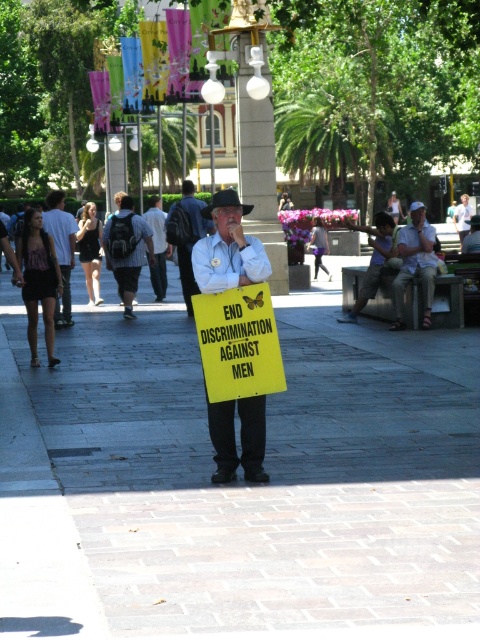
You are a photographer standing in the plaza and want to take a photo of both the white paper sign at center and the yellow paper sign at center. Which sign will appear larger in the photo?

The white paper sign at center will appear larger in the photo because it is closer to the photographer than the yellow paper sign at center.

You are a photographer trying to capture both the white cloth shirt at center and the striped shirt at center in a single frame. Based on their sizes in the image, which one should you focus on first to ensure both are in focus?

The white cloth shirt at center is taller than striped shirt at center, so focusing on the white cloth shirt at center first would help ensure both are in focus since it is larger and likely closer to the camera.